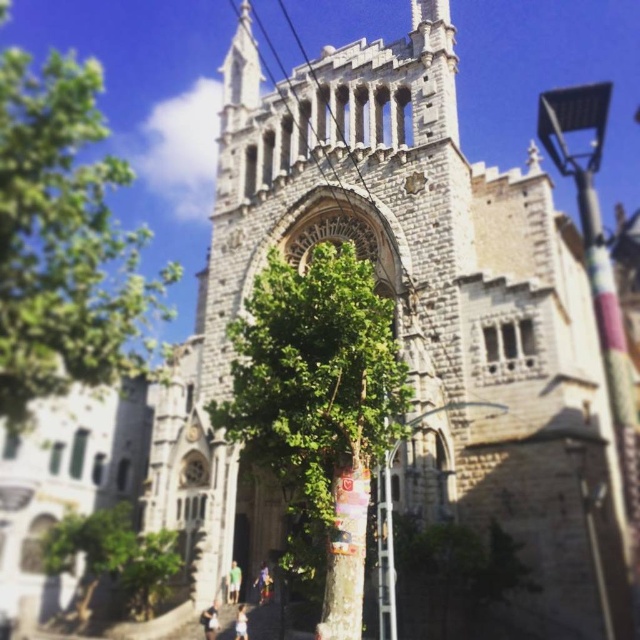
Looking at this image, can you confirm if green leafy tree at center is wider than green leafy tree at lower left?

Yes.

Is green leafy tree at center above green leafy tree at lower left?

Yes.

Is point (355, 488) positioned after point (113, 515)?

No, (355, 488) is closer to viewer.

Find the location of a particular element. Image resolution: width=640 pixels, height=640 pixels. green leafy tree at center is located at coordinates (317, 408).

From the picture: Is green leafy tree at center to the right of green leafy tree at upper left from the viewer's perspective?

Indeed, green leafy tree at center is positioned on the right side of green leafy tree at upper left.

Does green leafy tree at center appear over green leafy tree at upper left?

No.

Where is `green leafy tree at center`? green leafy tree at center is located at coordinates (317, 408).

Who is positioned more to the right, green leafy tree at upper left or green leafy tree at lower left?

From the viewer's perspective, green leafy tree at lower left appears more on the right side.

Can you confirm if green leafy tree at upper left is positioned to the left of green leafy tree at lower left?

Correct, you'll find green leafy tree at upper left to the left of green leafy tree at lower left.

Between point (28, 292) and point (44, 554), which one is positioned behind?

Point (44, 554)

Locate an element on the screen. Image resolution: width=640 pixels, height=640 pixels. green leafy tree at upper left is located at coordinates (65, 241).